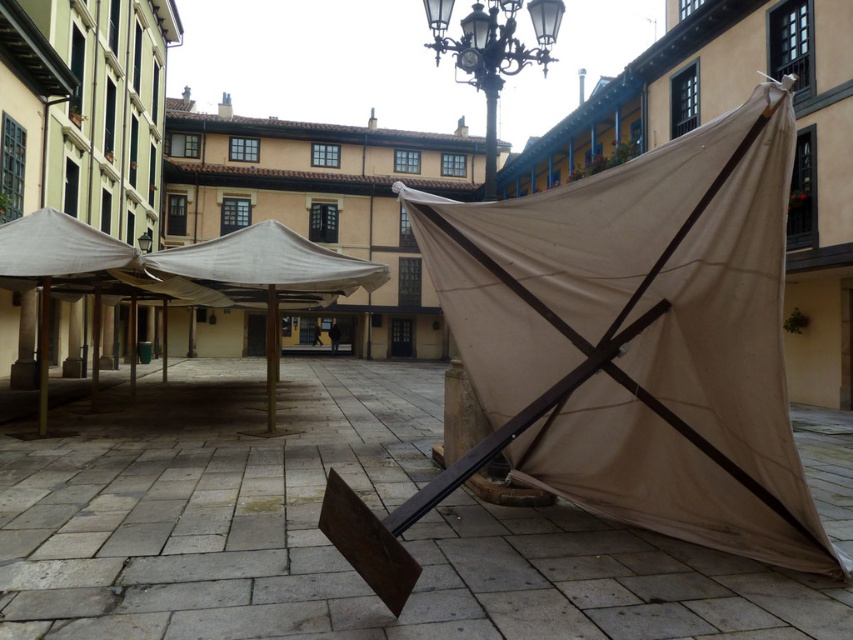
Question: Among these points, which one is farthest from the camera?

Choices:
 (A) (445, 42)
 (B) (465, 632)
 (C) (355, 280)

Answer: (C)

Question: Does white fabric umbrella at center have a larger size compared to black wrought iron streetlight at upper center?

Choices:
 (A) yes
 (B) no

Answer: (A)

Question: Does matte brown tent at center have a smaller size compared to black wrought iron streetlight at upper center?

Choices:
 (A) yes
 (B) no

Answer: (A)

Question: Considering the real-world distances, which object is closest to the metallic streetlight at center?

Choices:
 (A) matte brown tent at center
 (B) white fabric umbrella at center
 (C) black wrought iron streetlight at upper center

Answer: (C)

Question: Does matte brown tent at center appear under black wrought iron streetlight at upper center?

Choices:
 (A) yes
 (B) no

Answer: (A)

Question: Which object is farther from the camera taking this photo?

Choices:
 (A) matte brown tent at center
 (B) black wrought iron streetlight at upper center
 (C) metallic streetlight at center
 (D) white fabric umbrella at center

Answer: (D)